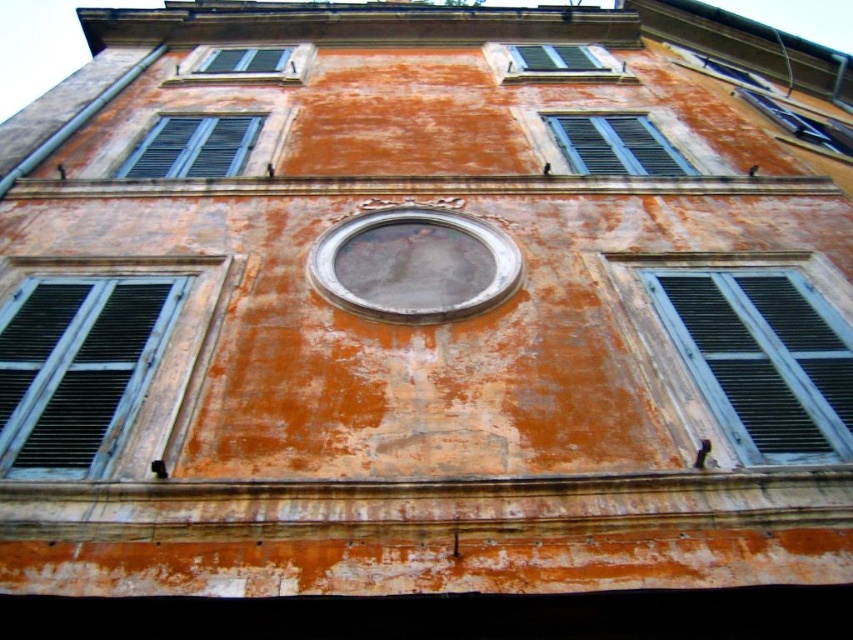
Question: Can you confirm if matte black shutters at right is positioned to the left of blue matte window at upper center?

Choices:
 (A) yes
 (B) no

Answer: (B)

Question: Among these objects, which one is nearest to the camera?

Choices:
 (A) blue matte shutter at left
 (B) matte gray shutters at upper left
 (C) green matte shutters at upper center
 (D) blue matte window at upper center

Answer: (A)

Question: Is blue matte shutter at left below matte gray shutters at upper left?

Choices:
 (A) no
 (B) yes

Answer: (B)

Question: Which object is farther from the camera taking this photo?

Choices:
 (A) green matte shutters at upper center
 (B) blue matte shutter at left
 (C) matte black shutters at upper left

Answer: (A)

Question: Can you confirm if matte black shutters at right is positioned above blue matte shutter at left?

Choices:
 (A) no
 (B) yes

Answer: (B)

Question: Which object is closer to the camera taking this photo?

Choices:
 (A) matte gray shutters at upper left
 (B) blue matte shutter at left
 (C) matte black shutters at upper left

Answer: (B)